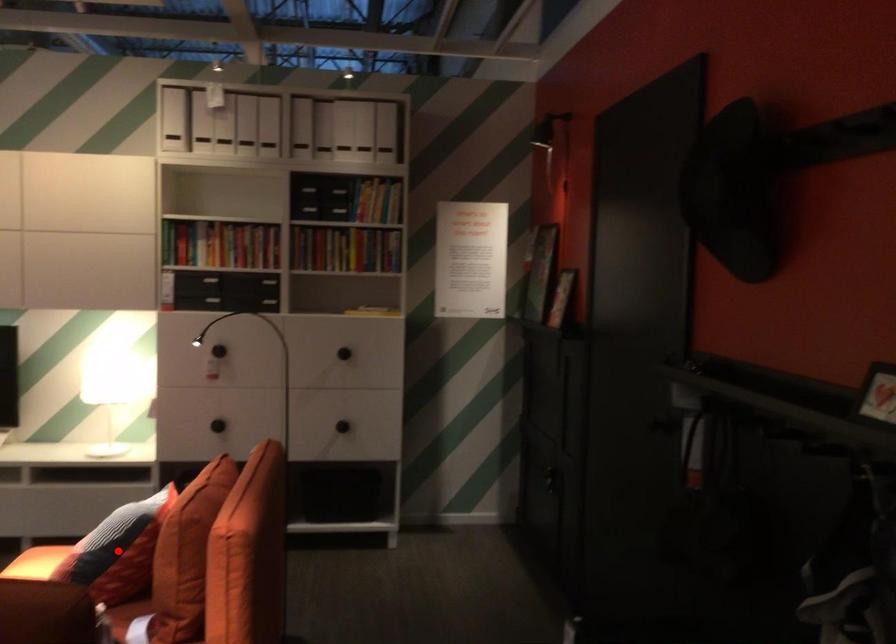
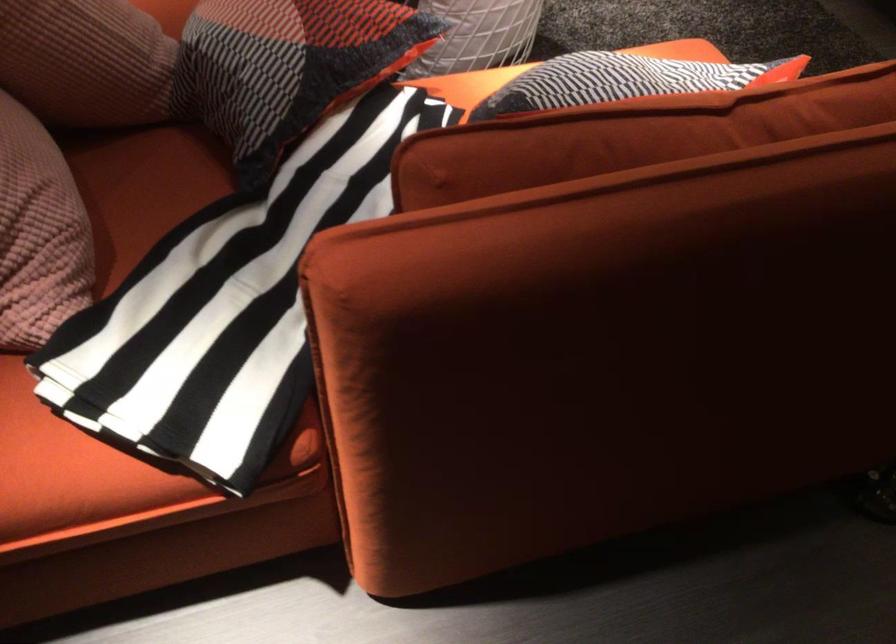
Question: I am providing you with two images of the same scene from different viewpoints. A red point is marked on the first image. Can you still see the location of the red point in image 2?

Choices:
 (A) Yes
 (B) No

Answer: (B)